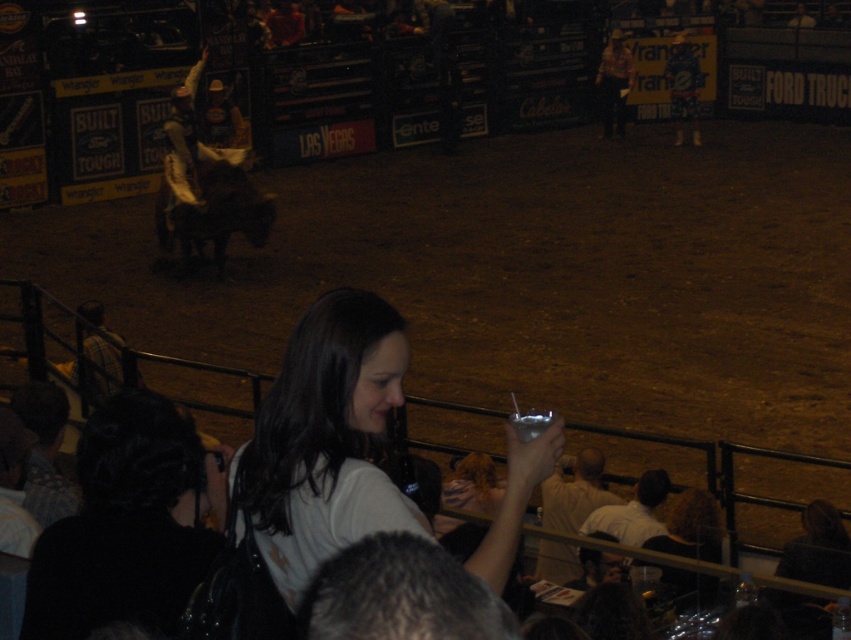
Question: Which point appears closest to the camera in this image?

Choices:
 (A) (103, 609)
 (B) (175, 211)
 (C) (284, 547)
 (D) (551, 518)

Answer: (C)

Question: Does dark brown leather horse at center come in front of light beige shirt at lower center?

Choices:
 (A) yes
 (B) no

Answer: (B)

Question: Which object is positioned farthest from the dark brown leather horse at center?

Choices:
 (A) white matte shirt at center
 (B) light beige shirt at lower center

Answer: (A)

Question: Is black fabric hair at lower left above dark brown leather horse at center?

Choices:
 (A) yes
 (B) no

Answer: (B)

Question: In this image, where is white matte shirt at center located relative to dark brown leather horse at center?

Choices:
 (A) left
 (B) right

Answer: (B)

Question: Which object is positioned closest to the dark brown leather horse at center?

Choices:
 (A) white matte shirt at center
 (B) black fabric hair at lower left
 (C) light beige shirt at lower center

Answer: (C)